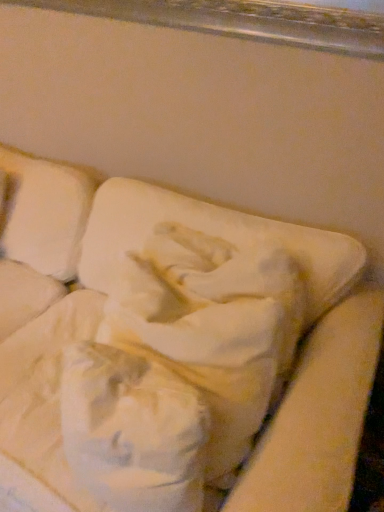
Question: From the image's perspective, is white soft pillow at center located above or below white fabric cushion at center?

Choices:
 (A) below
 (B) above

Answer: (B)

Question: Would you say white soft pillow at center is inside or outside white fabric cushion at center?

Choices:
 (A) inside
 (B) outside

Answer: (A)

Question: From a real-world perspective, is white soft pillow at center above or below white fabric cushion at center?

Choices:
 (A) below
 (B) above

Answer: (B)

Question: Choose the correct answer: Is white fabric cushion at center inside white soft pillow at center or outside it?

Choices:
 (A) outside
 (B) inside

Answer: (A)

Question: Would you say white fabric cushion at center is to the left or to the right of white soft pillow at center in the picture?

Choices:
 (A) right
 (B) left

Answer: (B)

Question: In terms of width, does white fabric cushion at center look wider or thinner when compared to white soft pillow at center?

Choices:
 (A) wide
 (B) thin

Answer: (A)

Question: From a real-world perspective, is white fabric cushion at center positioned above or below white soft pillow at center?

Choices:
 (A) below
 (B) above

Answer: (A)